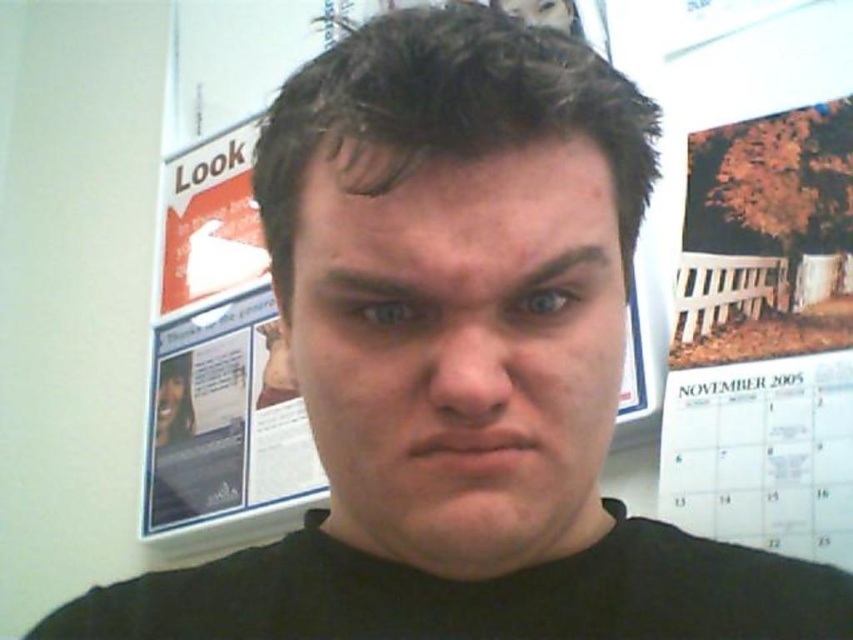
Question: Does matte skin face at center have a lesser width compared to white paper calendar at right?

Choices:
 (A) no
 (B) yes

Answer: (B)

Question: Which point is closer to the camera taking this photo?

Choices:
 (A) (798, 448)
 (B) (331, 516)

Answer: (B)

Question: Is matte skin face at center to the left of white paper calendar at right from the viewer's perspective?

Choices:
 (A) yes
 (B) no

Answer: (A)

Question: Does matte skin face at center appear under white paper calendar at right?

Choices:
 (A) no
 (B) yes

Answer: (A)